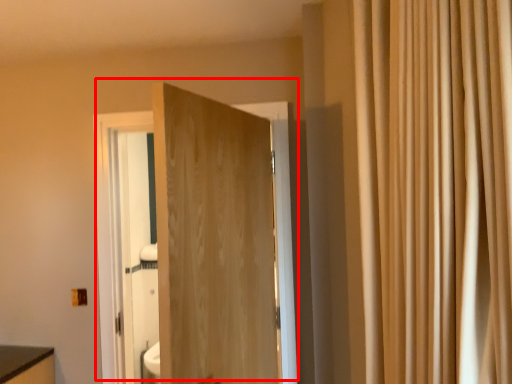
Question: In this image, where is door (annotated by the red box) located relative to curtain?

Choices:
 (A) right
 (B) left

Answer: (B)